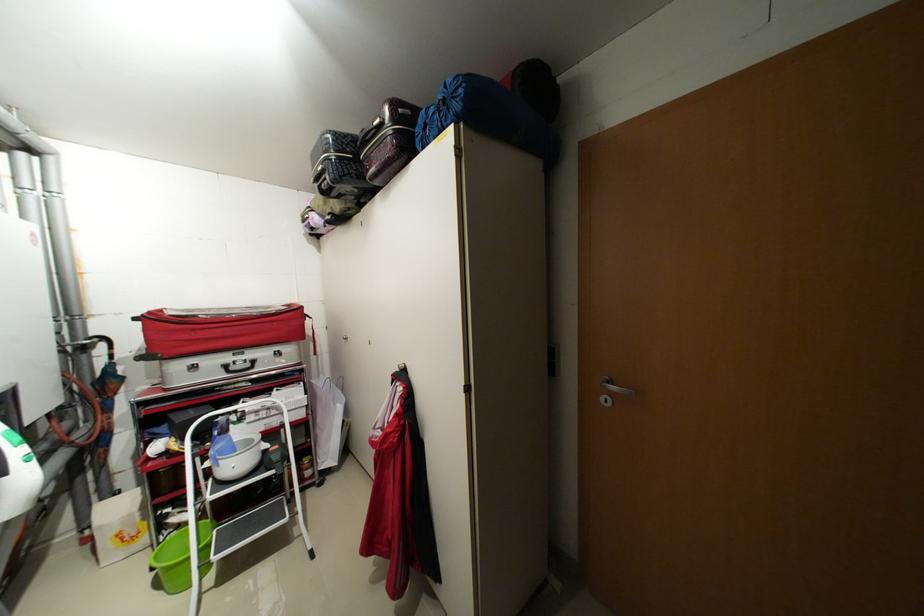
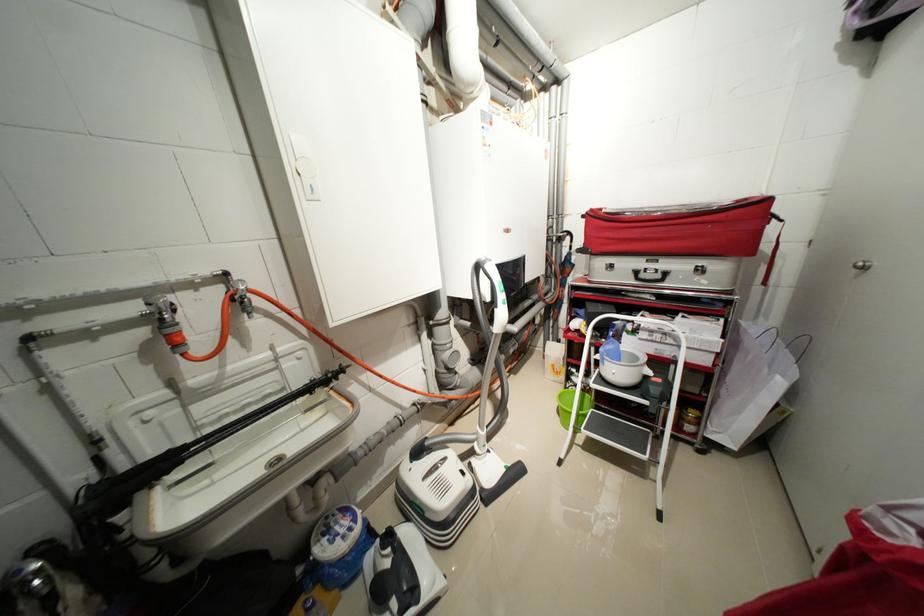
Find the pixel in the second image that matches the point at 346,408 in the first image.

(787, 384)